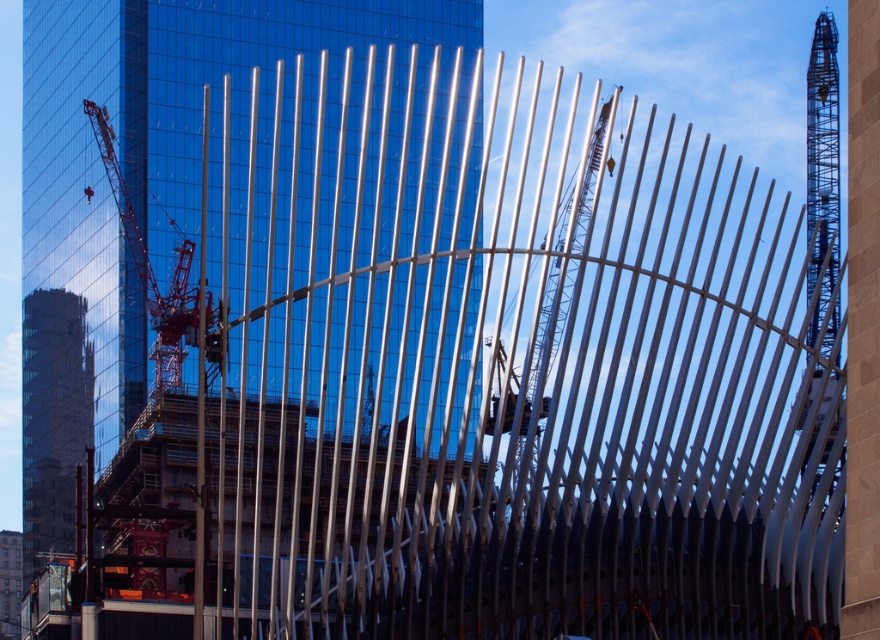
Can you confirm if reddish-orange metallic crane at left is positioned to the left of red reflective safety vest at center?

No, reddish-orange metallic crane at left is not to the left of red reflective safety vest at center.

Is reddish-orange metallic crane at left bigger than red reflective safety vest at center?

Correct, reddish-orange metallic crane at left is larger in size than red reflective safety vest at center.

Does point (105, 170) come in front of point (90, 189)?

Yes.

The image size is (880, 640). Find the location of `reddish-orange metallic crane at left`. reddish-orange metallic crane at left is located at coordinates (154, 273).

Does metallic silver crane at center appear under reddish-orange metallic crane at left?

Indeed, metallic silver crane at center is positioned under reddish-orange metallic crane at left.

Is metallic silver crane at center thinner than reddish-orange metallic crane at left?

Yes.

The image size is (880, 640). Find the location of `metallic silver crane at center`. metallic silver crane at center is located at coordinates (548, 310).

Locate an element on the screen. The width and height of the screenshot is (880, 640). metallic silver crane at center is located at coordinates (548, 310).

Is metallic silver crane at center further to camera compared to red reflective safety vest at center?

That is False.

Is metallic silver crane at center wider than red reflective safety vest at center?

Correct, the width of metallic silver crane at center exceeds that of red reflective safety vest at center.

You are a GUI agent. You are given a task and a screenshot of the screen. Output one action in this format:
    pyautogui.click(x=<x>, y=<y>)
    Task: Click on the metallic silver crane at center
    The image size is (880, 640).
    Given the screenshot: What is the action you would take?
    pyautogui.click(x=548, y=310)